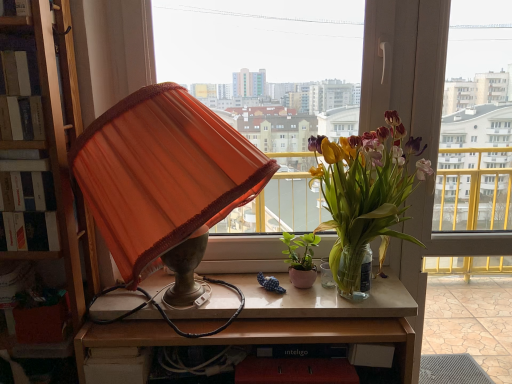
Find the location of a particular element. vacant region to the left of green matte plant at center, acting as the 1th houseplant starting from the left is located at coordinates (247, 286).